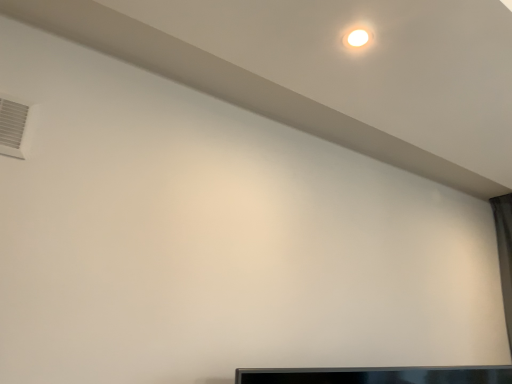
Question: In the image, is white plastic air conditioning at upper left positioned in front of or behind black glossy tv at lower center?

Choices:
 (A) behind
 (B) front

Answer: (B)

Question: Is white plastic air conditioning at upper left taller or shorter than black glossy tv at lower center?

Choices:
 (A) tall
 (B) short

Answer: (A)

Question: From the image's perspective, relative to black glossy tv at lower center, is white plastic air conditioning at upper left above or below?

Choices:
 (A) above
 (B) below

Answer: (A)

Question: Is black glossy tv at lower center to the left or to the right of white plastic air conditioning at upper left in the image?

Choices:
 (A) left
 (B) right

Answer: (B)

Question: Is point (320, 372) positioned closer to the camera than point (27, 110)?

Choices:
 (A) closer
 (B) farther

Answer: (B)

Question: Is black glossy tv at lower center inside the boundaries of white plastic air conditioning at upper left, or outside?

Choices:
 (A) inside
 (B) outside

Answer: (B)

Question: From the image's perspective, relative to white plastic air conditioning at upper left, is black glossy tv at lower center above or below?

Choices:
 (A) above
 (B) below

Answer: (B)